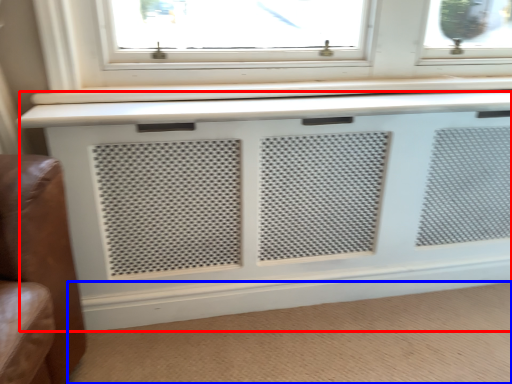
Question: Among these objects, which one is farthest to the camera, air conditioning (highlighted by a red box) or plain (highlighted by a blue box)?

Choices:
 (A) air conditioning
 (B) plain

Answer: (A)